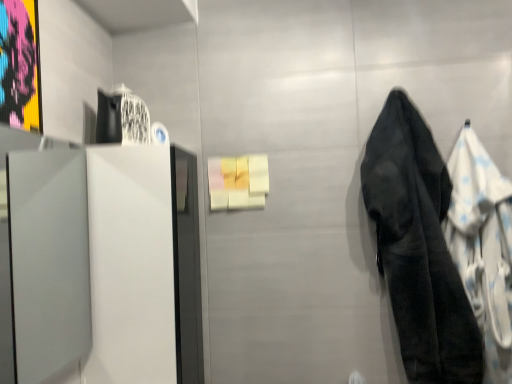
The image size is (512, 384). Describe the element at coordinates (418, 248) in the screenshot. I see `black fabric towel at right` at that location.

This screenshot has width=512, height=384. I want to click on black fabric towel at right, so click(x=418, y=248).

Locate an element on the screen. Image resolution: width=512 pixels, height=384 pixels. black fabric coat at right is located at coordinates (483, 246).

The image size is (512, 384). What do you see at coordinates (483, 246) in the screenshot? I see `black fabric coat at right` at bounding box center [483, 246].

You are a GUI agent. You are given a task and a screenshot of the screen. Output one action in this format:
    pyautogui.click(x=<x>, y=<y>)
    Task: Click on the black fabric towel at right
    This screenshot has height=384, width=512.
    Given the screenshot: What is the action you would take?
    pyautogui.click(x=418, y=248)

Consider the image. Which object is positioned more to the right, black fabric towel at right or black fabric coat at right?

From the viewer's perspective, black fabric coat at right appears more on the right side.

Which is behind, black fabric towel at right or black fabric coat at right?

black fabric coat at right.

Is point (445, 320) closer to viewer compared to point (507, 306)?

Yes.

Consider the image. From the image's perspective, which one is positioned lower, black fabric towel at right or black fabric coat at right?

black fabric coat at right appears lower in the image.

In the scene shown: From a real-world perspective, is black fabric towel at right located higher than black fabric coat at right?

Yes, from a real-world perspective, black fabric towel at right is on top of black fabric coat at right.

Considering the relative sizes of black fabric towel at right and black fabric coat at right in the image provided, is black fabric towel at right wider than black fabric coat at right?

Correct, the width of black fabric towel at right exceeds that of black fabric coat at right.

Considering the sizes of objects black fabric towel at right and black fabric coat at right in the image provided, who is taller, black fabric towel at right or black fabric coat at right?

Standing taller between the two is black fabric towel at right.

Consider the image. Is black fabric towel at right bigger than black fabric coat at right?

Yes.

Is black fabric towel at right positioned beyond the bounds of black fabric coat at right?

Yes.

Is black fabric towel at right far away from black fabric coat at right?

No.

In the scene shown: Could you tell me if black fabric towel at right is facing black fabric coat at right?

No, black fabric towel at right is not facing towards black fabric coat at right.

What's the angular difference between black fabric towel at right and black fabric coat at right's facing directions?

The angle between the facing direction of black fabric towel at right and the facing direction of black fabric coat at right is 2.01 degrees.

Where is `towel/napkin that is in front of the black fabric coat at right`? The height and width of the screenshot is (384, 512). towel/napkin that is in front of the black fabric coat at right is located at coordinates (418, 248).

Which is more to the left, black fabric coat at right or black fabric towel at right?

Positioned to the left is black fabric towel at right.

Is black fabric coat at right further to the viewer compared to black fabric towel at right?

Yes, black fabric coat at right is behind black fabric towel at right.

Which point is more forward, (477, 294) or (474, 381)?

The point (474, 381) is closer.

From the image's perspective, which object appears higher, black fabric coat at right or black fabric towel at right?

black fabric towel at right appears higher in the image.

From a real-world perspective, is black fabric coat at right located beneath black fabric towel at right?

Yes, from a real-world perspective, black fabric coat at right is beneath black fabric towel at right.

Which of these two, black fabric coat at right or black fabric towel at right, is thinner?

black fabric coat at right is thinner.

Is black fabric coat at right shorter than black fabric towel at right?

Yes, black fabric coat at right is shorter than black fabric towel at right.

Does black fabric coat at right have a larger size compared to black fabric towel at right?

No, black fabric coat at right is not bigger than black fabric towel at right.

In the scene shown: Can black fabric towel at right be found inside black fabric coat at right?

No.

Is black fabric coat at right beside black fabric towel at right?

No, black fabric coat at right is not next to black fabric towel at right.

Is black fabric coat at right facing away from black fabric towel at right?

No, black fabric coat at right is not facing away from black fabric towel at right.

How far apart are black fabric coat at right and black fabric towel at right?

A distance of 5.33 inches exists between black fabric coat at right and black fabric towel at right.

Where is `cloak located behind the black fabric towel at right`? cloak located behind the black fabric towel at right is located at coordinates (483, 246).

In order to click on cloak lying on the right of black fabric towel at right in this screenshot , I will do `click(483, 246)`.

Where is `towel/napkin located on the left of black fabric coat at right`? towel/napkin located on the left of black fabric coat at right is located at coordinates (418, 248).